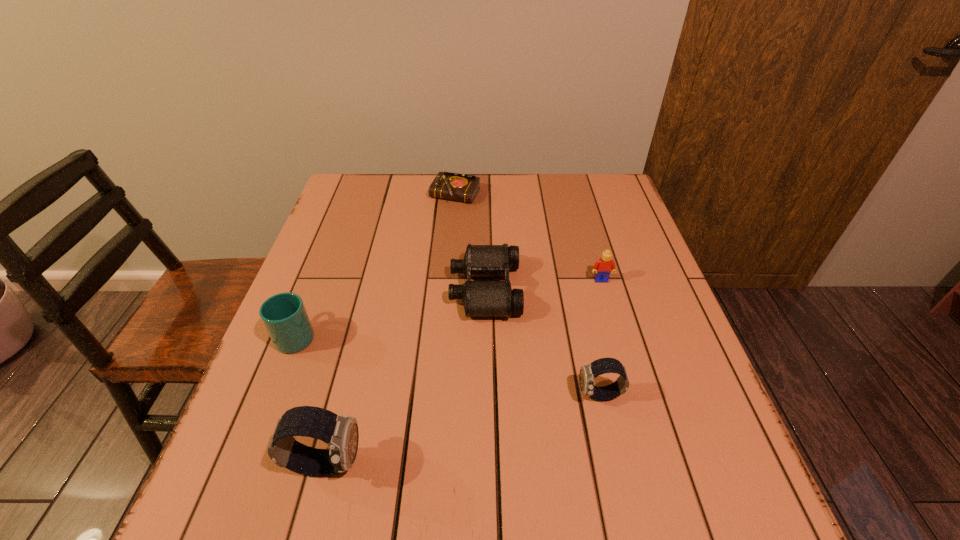
If we want them evenly spaced by inserting an extra watch among them, please locate a free spot for this new watch. Please provide its 2D coordinates. Your answer should be formatted as a tuple, i.e. [(x, y)], where the tuple contains the x and y coordinates of a point satisfying the conditions above.

[(470, 427)]